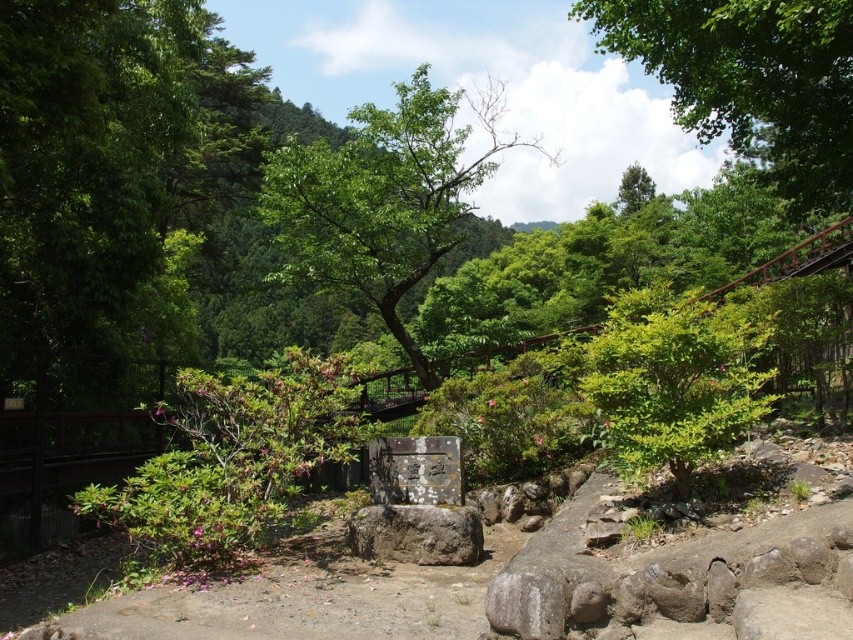
You are planning to place a picnic blanket between the green leafy tree at center and the green leafy bush at center. Which object should you consider for spacing due to its larger width?

The green leafy tree at center might be wider than the green leafy bush at center, so you should consider the green leafy tree at center for spacing.

You are a hiker who wants to take a photo of the green leafy tree at center and the green leafy bush at center. Which one should you get closer to in order to capture more details in your photo?

The green leafy tree at center is larger in size compared to the green leafy bush at center, so you should get closer to the green leafy bush at center to capture more details.

You are standing at the monument in the foreground of the scene. You see two points in the image, point 1 at coordinates point (352, 122) and point 2 at coordinates point (403, 557). Which point is closer to you?

Point (352, 122) is closer to you than point (403, 557) because it is further to the camera.